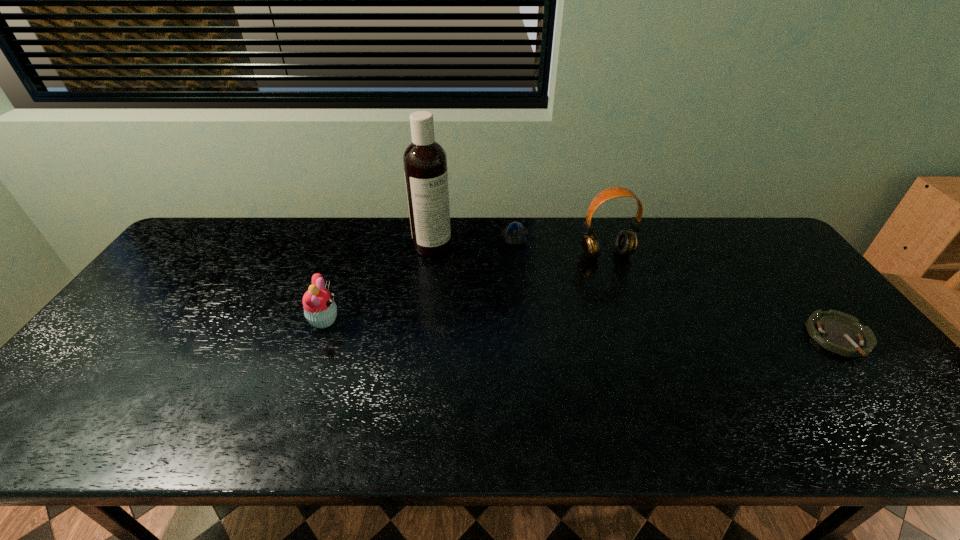
Locate an element on the screen. The height and width of the screenshot is (540, 960). free area in between the fourth tallest object and the second object from left to right is located at coordinates (473, 241).

This screenshot has height=540, width=960. Identify the location of free space between the headset and the cupcake. (465, 287).

Identify the location of empty location between the computer mouse and the shortest object. The height and width of the screenshot is (540, 960). (677, 287).

Find the location of a particular element. The height and width of the screenshot is (540, 960). vacant space that is in between the second tallest object and the third tallest object is located at coordinates (465, 287).

The height and width of the screenshot is (540, 960). I want to click on free space that is in between the third object from right to left and the ashtray, so click(677, 287).

Locate an element on the screen. blank region between the third shortest object and the ashtray is located at coordinates coord(582,329).

I want to click on free space between the cupcake and the ashtray, so click(582, 329).

This screenshot has height=540, width=960. I want to click on free space between the third shortest object and the headset, so click(465, 287).

I want to click on vacant region between the cupcake and the third object from left to right, so click(x=420, y=278).

At what (x,y) coordinates should I click in order to perform the action: click on object that ranks as the second closest to the leftmost object. Please return your answer as a coordinate pair (x, y). The height and width of the screenshot is (540, 960). Looking at the image, I should click on (515, 234).